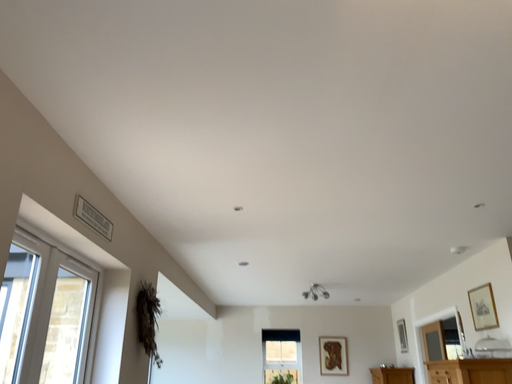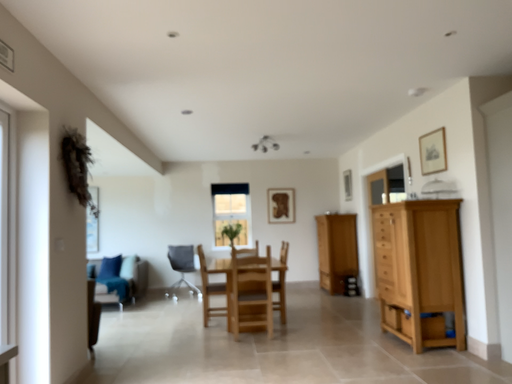
Question: How did the camera likely rotate when shooting the video?

Choices:
 (A) rotated upward
 (B) rotated downward

Answer: (B)